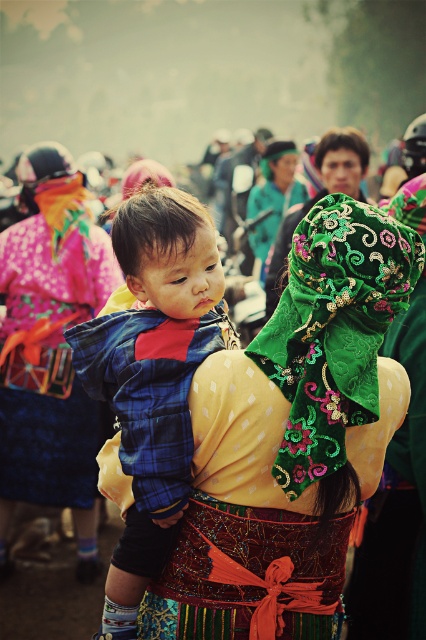
Question: Which of the following is the closest to the observer?

Choices:
 (A) embroidered silk headscarf at center
 (B) blue plaid shirt at center

Answer: (A)

Question: Does smooth brown hair at center have a greater width compared to green embroidered fabric at upper center?

Choices:
 (A) no
 (B) yes

Answer: (B)

Question: Which object is the farthest from the smooth brown hair at center?

Choices:
 (A) matte blue shirt at center
 (B) blue plaid shirt at center

Answer: (B)

Question: Can you confirm if embroidered silk headscarf at center is positioned to the left of matte blue shirt at center?

Choices:
 (A) yes
 (B) no

Answer: (B)

Question: Observing the image, what is the correct spatial positioning of matte blue shirt at center in reference to matte blue plaid shirt at center?

Choices:
 (A) left
 (B) right

Answer: (A)

Question: Based on their relative distances, which object is farther from the matte blue plaid shirt at center?

Choices:
 (A) green embroidered fabric at upper center
 (B) smooth brown hair at center
 (C) matte blue shirt at center
 (D) embroidered silk headscarf at center

Answer: (A)